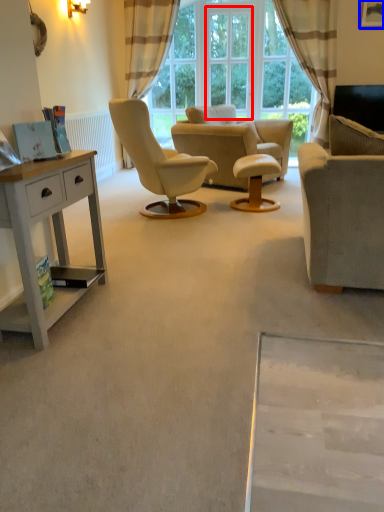
Question: Among these objects, which one is nearest to the camera, window screen (highlighted by a red box) or picture frame (highlighted by a blue box)?

Choices:
 (A) window screen
 (B) picture frame

Answer: (B)